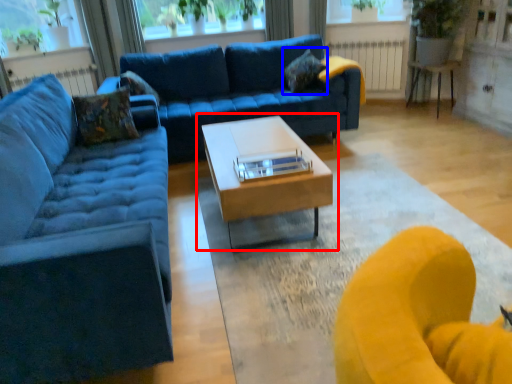
Question: Which object is further to the camera taking this photo, coffee table (highlighted by a red box) or pillow (highlighted by a blue box)?

Choices:
 (A) coffee table
 (B) pillow

Answer: (B)